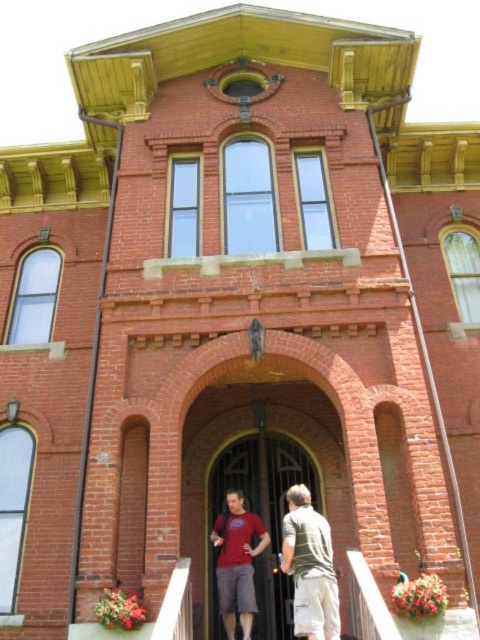
Question: Which point is closer to the camera?

Choices:
 (A) (242, 627)
 (B) (287, 552)

Answer: (B)

Question: In this image, where is black metal door at center located relative to matte red t-shirt at center?

Choices:
 (A) right
 (B) left

Answer: (A)

Question: Which of these objects is positioned closest to the green textured shirt at center?

Choices:
 (A) black metal door at center
 (B) matte red t-shirt at center

Answer: (A)

Question: Is the position of black metal door at center less distant than that of green textured shirt at center?

Choices:
 (A) no
 (B) yes

Answer: (A)

Question: Which object is farther from the camera taking this photo?

Choices:
 (A) green textured shirt at center
 (B) black metal door at center
 (C) matte red t-shirt at center

Answer: (B)

Question: Considering the relative positions of black metal door at center and matte red t-shirt at center in the image provided, where is black metal door at center located with respect to matte red t-shirt at center?

Choices:
 (A) above
 (B) below

Answer: (A)